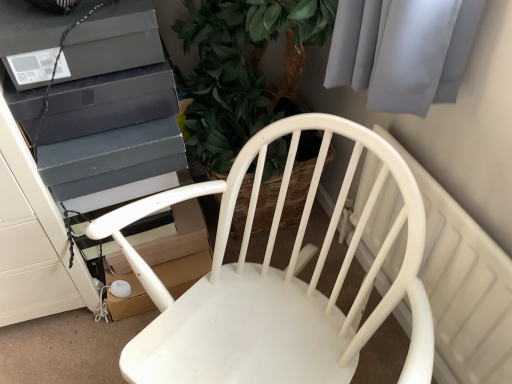
Question: From a real-world perspective, is matte black box at upper left, which is counted as the first appliance, starting from the bottom, over white plastic radiator at upper right?

Choices:
 (A) yes
 (B) no

Answer: (A)

Question: Are matte black box at upper left, which is counted as the first appliance, starting from the bottom, and white plastic radiator at upper right far apart?

Choices:
 (A) no
 (B) yes

Answer: (A)

Question: Is matte black box at upper left, which is counted as the first appliance, starting from the bottom, closer to the viewer compared to white plastic radiator at upper right?

Choices:
 (A) no
 (B) yes

Answer: (A)

Question: Are matte black box at upper left, which is counted as the 2th appliance, starting from the top, and white plastic radiator at upper right making contact?

Choices:
 (A) no
 (B) yes

Answer: (A)

Question: Is matte black box at upper left, which is counted as the 2th appliance, starting from the top, at the left side of white plastic radiator at upper right?

Choices:
 (A) yes
 (B) no

Answer: (A)

Question: From a real-world perspective, relative to matte black box at upper left, which is counted as the first appliance, starting from the bottom, is white plastic radiator at upper right vertically above or below?

Choices:
 (A) above
 (B) below

Answer: (B)

Question: From the image's perspective, is white plastic radiator at upper right located above or below matte black box at upper left, which is counted as the first appliance, starting from the bottom?

Choices:
 (A) below
 (B) above

Answer: (A)

Question: In the image, is white plastic radiator at upper right positioned in front of or behind matte black box at upper left, which is counted as the first appliance, starting from the bottom?

Choices:
 (A) behind
 (B) front

Answer: (B)

Question: Is white plastic radiator at upper right situated inside matte black box at upper left, which is counted as the 2th appliance, starting from the top, or outside?

Choices:
 (A) outside
 (B) inside

Answer: (A)

Question: Based on their sizes in the image, would you say matte black box at upper left, which is counted as the 2th appliance, starting from the top, is bigger or smaller than white plastic radiator at upper right?

Choices:
 (A) small
 (B) big

Answer: (A)

Question: From the image's perspective, is matte black box at upper left, which is counted as the first appliance, starting from the bottom, above or below white plastic radiator at upper right?

Choices:
 (A) below
 (B) above

Answer: (B)

Question: From a real-world perspective, is matte black box at upper left, which is counted as the 2th appliance, starting from the top, above or below white plastic radiator at upper right?

Choices:
 (A) above
 (B) below

Answer: (A)

Question: Relative to white plastic radiator at upper right, is matte black box at upper left, which is counted as the 2th appliance, starting from the top, in front or behind?

Choices:
 (A) front
 (B) behind

Answer: (B)

Question: From a real-world perspective, is matte black speaker at upper left, marked as the first appliance in a top-to-bottom arrangement, above or below white matte chair at center?

Choices:
 (A) above
 (B) below

Answer: (A)

Question: In the image, is matte black speaker at upper left, the second appliance ordered from the bottom, positioned in front of or behind white matte chair at center?

Choices:
 (A) behind
 (B) front

Answer: (A)